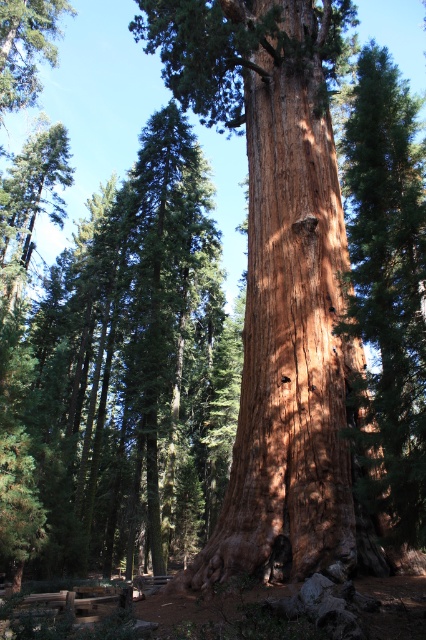
Between point (321, 236) and point (54, 60), which one is positioned in front?

Point (321, 236) is in front.

What do you see at coordinates (276, 275) in the screenshot? I see `smooth reddish-brown trunk at center` at bounding box center [276, 275].

Identify the location of smooth reddish-brown trunk at center. The height and width of the screenshot is (640, 426). (276, 275).

Find the location of a particular element. smooth reddish-brown trunk at center is located at coordinates (276, 275).

Can you confirm if smooth reddish-brown trunk at center is thinner than brown rough bark tree at center?

No.

Is smooth reddish-brown trunk at center below brown rough bark tree at center?

No, smooth reddish-brown trunk at center is not below brown rough bark tree at center.

Is point (353, 552) more distant than point (405, 186)?

Yes, point (353, 552) is farther from viewer.

This screenshot has height=640, width=426. In order to click on smooth reddish-brown trunk at center in this screenshot , I will do `click(276, 275)`.

Does brown rough bark tree at center appear over green matte tree at upper left?

Incorrect, brown rough bark tree at center is not positioned above green matte tree at upper left.

Which is behind, point (351, 96) or point (16, 22)?

Positioned behind is point (351, 96).

Locate an element on the screen. brown rough bark tree at center is located at coordinates (388, 291).